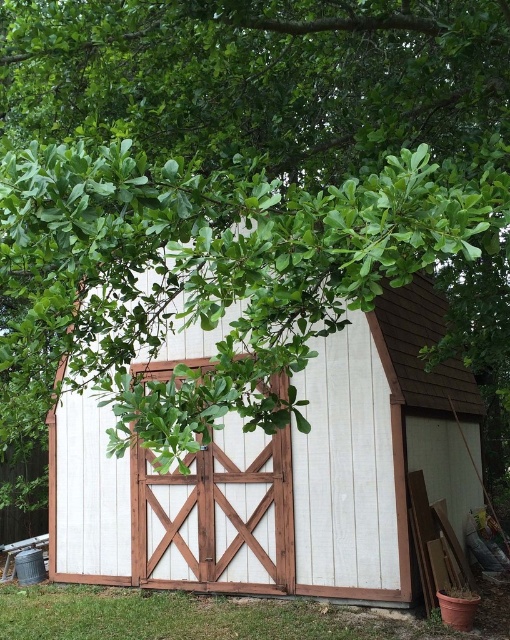
Question: Is white wood barn at center smaller than white wood barn door at center?

Choices:
 (A) no
 (B) yes

Answer: (A)

Question: Which point appears farthest from the camera in this image?

Choices:
 (A) click(x=94, y=520)
 (B) click(x=219, y=504)

Answer: (A)

Question: Is white wood barn at center closer to the viewer compared to white wood barn door at center?

Choices:
 (A) yes
 (B) no

Answer: (A)

Question: Among these objects, which one is nearest to the camera?

Choices:
 (A) white wood barn door at center
 (B) white wood barn at center

Answer: (B)

Question: Does white wood barn at center have a larger size compared to white wood barn door at center?

Choices:
 (A) yes
 (B) no

Answer: (A)

Question: Among these objects, which one is nearest to the camera?

Choices:
 (A) white wood barn at center
 (B) white wood barn door at center

Answer: (A)